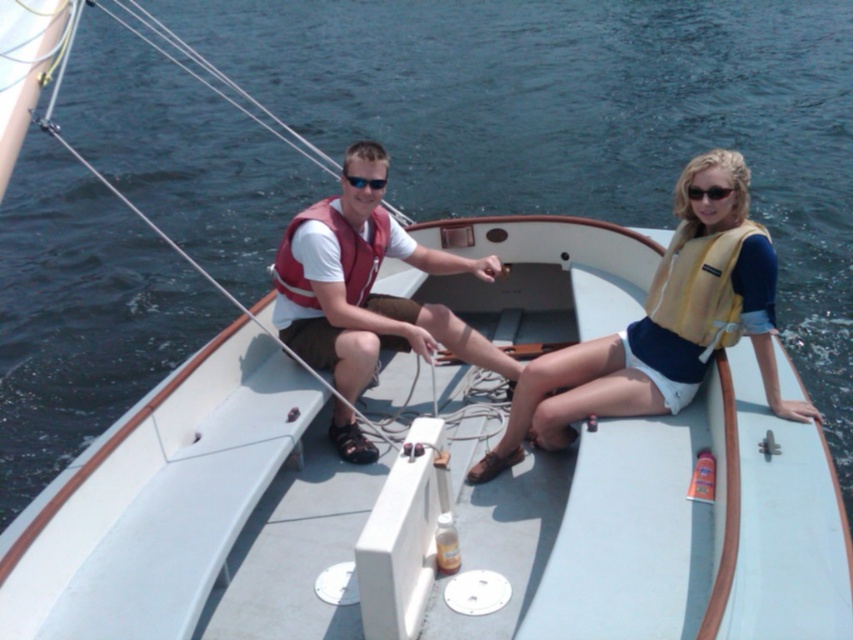
You are a safety inspector checking the equipment on the boat. You notice the matte red life jacket at center and the black plastic sunglasses at upper right. Which item has a greater width?

The matte red life jacket at center has a greater width than the black plastic sunglasses at upper right.

You are standing on the deck of a ship and see a point at coordinates (366, 285). What object is located at that point?

The object at point (366, 285) is the matte red life vest at center.